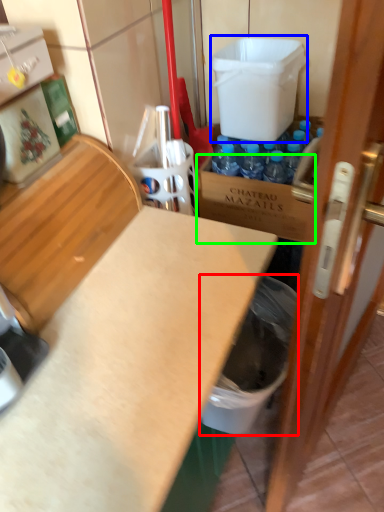
Question: Estimate the real-world distances between objects in this image. Which object is farther from garbage (highlighted by a red box), water cooler (highlighted by a blue box) or cardboard box (highlighted by a green box)?

Choices:
 (A) water cooler
 (B) cardboard box

Answer: (A)